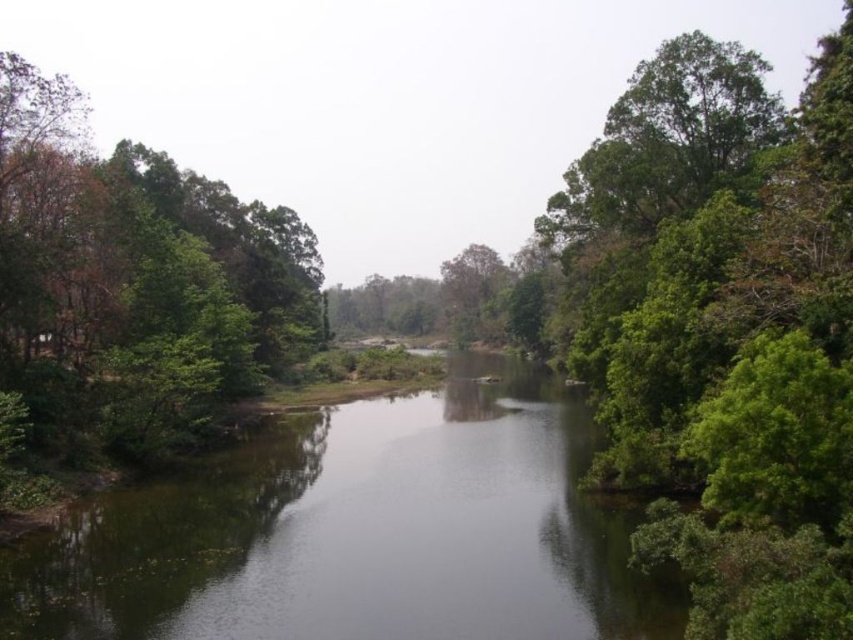
Can you confirm if green reflective water at center is shorter than green leafy tree at left?

Yes.

Can you confirm if green reflective water at center is smaller than green leafy tree at left?

Yes, green reflective water at center is smaller than green leafy tree at left.

At what (x,y) coordinates should I click in order to perform the action: click on green reflective water at center. Please return your answer as a coordinate pair (x, y). Looking at the image, I should click on (357, 531).

Is point (688, 356) closer to camera compared to point (38, 577)?

No, (688, 356) is further to viewer.

Is point (830, 426) positioned after point (250, 502)?

No, (830, 426) is closer to viewer.

Who is more distant from viewer, (846, 61) or (196, 480)?

Point (196, 480)

Identify the location of green leafy tree at right. This screenshot has width=853, height=640. (723, 330).

Between green leafy tree at right and green leafy tree at left, which one is positioned lower?

Positioned lower is green leafy tree at right.

From the picture: Is green leafy tree at right shorter than green leafy tree at left?

Correct, green leafy tree at right is not as tall as green leafy tree at left.

Image resolution: width=853 pixels, height=640 pixels. What do you see at coordinates (723, 330) in the screenshot? I see `green leafy tree at right` at bounding box center [723, 330].

The image size is (853, 640). Identify the location of green leafy tree at right. (723, 330).